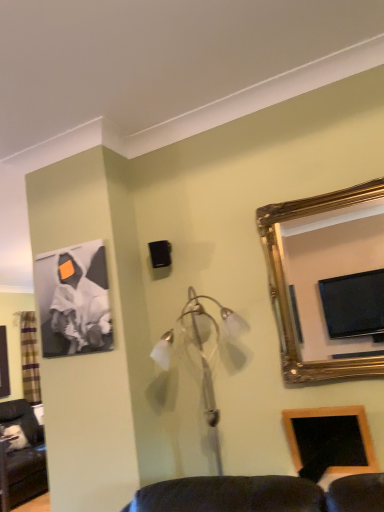
Question: From the image's perspective, is matte black canvas at upper left, marked as the second picture frame in a right-to-left arrangement, above wooden picture frame at lower right, which is the 1th picture frame in right-to-left order?

Choices:
 (A) yes
 (B) no

Answer: (A)

Question: Does matte black canvas at upper left, the first picture frame positioned from the left, have a lesser width compared to wooden picture frame at lower right, arranged as the 1th picture frame when viewed from the front?

Choices:
 (A) yes
 (B) no

Answer: (A)

Question: Does matte black canvas at upper left, marked as the second picture frame in a right-to-left arrangement, turn towards wooden picture frame at lower right, the 2th picture frame from the back?

Choices:
 (A) no
 (B) yes

Answer: (A)

Question: Would you consider matte black canvas at upper left, which ranks as the 2th picture frame in front-to-back order, to be distant from wooden picture frame at lower right, the first picture frame from the bottom?

Choices:
 (A) no
 (B) yes

Answer: (B)

Question: Is matte black canvas at upper left, marked as the second picture frame in a right-to-left arrangement, bigger than wooden picture frame at lower right, arranged as the 1th picture frame when viewed from the front?

Choices:
 (A) yes
 (B) no

Answer: (A)

Question: Is wooden picture frame at lower right, which appears as the second picture frame when viewed from the top, inside the boundaries of matte black canvas at upper left, arranged as the 1th picture frame when viewed from the back, or outside?

Choices:
 (A) inside
 (B) outside

Answer: (B)

Question: From a real-world perspective, is wooden picture frame at lower right, the 2th picture frame from the back, above or below matte black canvas at upper left, marked as the second picture frame in a right-to-left arrangement?

Choices:
 (A) above
 (B) below

Answer: (B)

Question: Would you say wooden picture frame at lower right, which appears as the second picture frame when viewed from the top, is to the left or to the right of matte black canvas at upper left, marked as the second picture frame in a right-to-left arrangement, in the picture?

Choices:
 (A) right
 (B) left

Answer: (A)

Question: Is point (331, 424) closer or farther from the camera than point (99, 257)?

Choices:
 (A) closer
 (B) farther

Answer: (A)

Question: Choose the correct answer: Is gold-framed mirror at upper right inside wooden picture frame at lower right, the 2th picture frame from the back, or outside it?

Choices:
 (A) inside
 (B) outside

Answer: (B)

Question: Considering the positions of point (362, 345) and point (357, 420), is point (362, 345) closer or farther from the camera than point (357, 420)?

Choices:
 (A) closer
 (B) farther

Answer: (B)

Question: In terms of width, does gold-framed mirror at upper right look wider or thinner when compared to wooden picture frame at lower right, which is the 1th picture frame in right-to-left order?

Choices:
 (A) wide
 (B) thin

Answer: (A)

Question: Is gold-framed mirror at upper right taller or shorter than wooden picture frame at lower right, the first picture frame from the bottom?

Choices:
 (A) tall
 (B) short

Answer: (A)

Question: Is plaid fabric curtain at left inside the boundaries of matte black canvas at upper left, the first picture frame positioned from the left, or outside?

Choices:
 (A) outside
 (B) inside

Answer: (A)

Question: Is plaid fabric curtain at left taller or shorter than matte black canvas at upper left, the 2th picture frame positioned from the bottom?

Choices:
 (A) short
 (B) tall

Answer: (B)